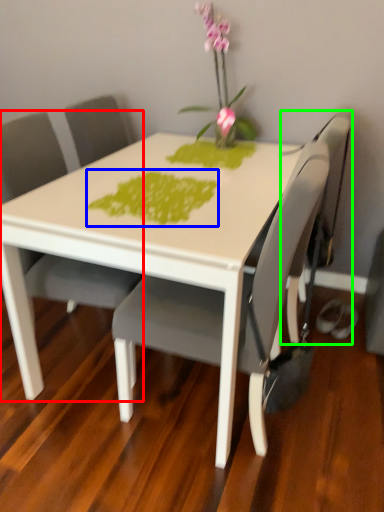
Question: Which is farther away from chair (highlighted by a red box)? design (highlighted by a blue box) or swivel chair (highlighted by a green box)?

Choices:
 (A) design
 (B) swivel chair

Answer: (B)